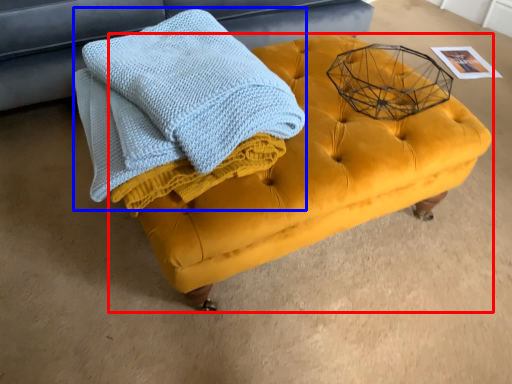
Question: Which of the following is the farthest to the observer, table (highlighted by a red box) or bath towel (highlighted by a blue box)?

Choices:
 (A) table
 (B) bath towel

Answer: (A)